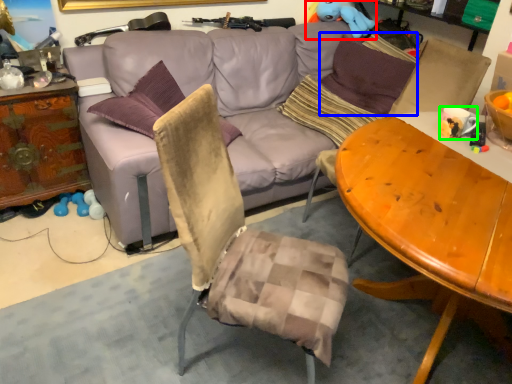
Question: Which object is the closest to the toy (highlighted by a red box)? Choose among these: pillow (highlighted by a blue box) or coffee cup (highlighted by a green box).

Choices:
 (A) pillow
 (B) coffee cup

Answer: (A)